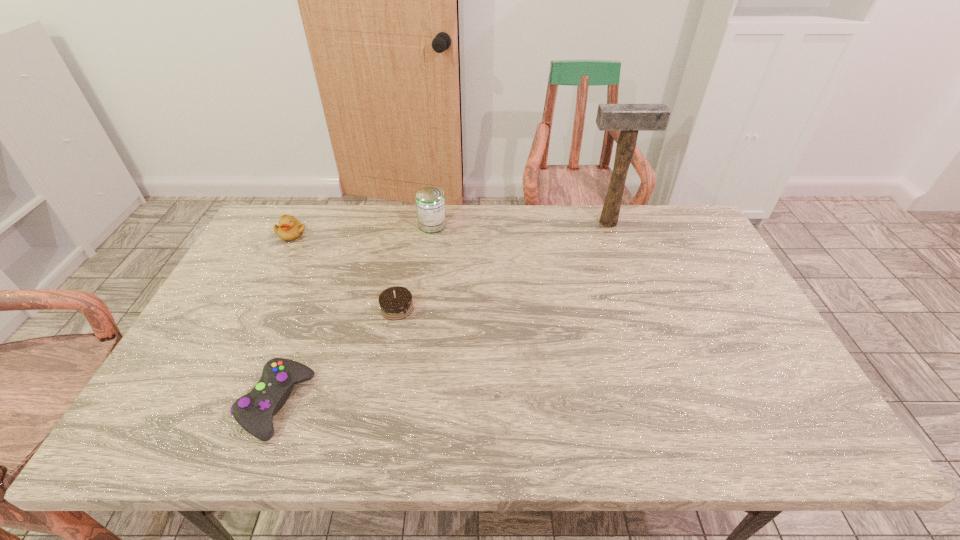
The height and width of the screenshot is (540, 960). What are the coordinates of `the tallest object` in the screenshot? It's located at (628, 118).

You are a GUI agent. You are given a task and a screenshot of the screen. Output one action in this format:
    pyautogui.click(x=<x>, y=<y>)
    Task: Click on the mallet
    
    Given the screenshot: What is the action you would take?
    pyautogui.click(x=628, y=118)

Identify the location of the second tallest object. (430, 202).

You are a GUI agent. You are given a task and a screenshot of the screen. Output one action in this format:
    pyautogui.click(x=<x>, y=<y>)
    Task: Click on the duckling
    This screenshot has width=960, height=540.
    Given the screenshot: What is the action you would take?
    pyautogui.click(x=290, y=228)

The image size is (960, 540). I want to click on the fourth farthest object, so click(x=395, y=302).

This screenshot has height=540, width=960. I want to click on the nearest object, so click(x=254, y=412).

Where is `the second object from left to right`? the second object from left to right is located at coordinates pyautogui.click(x=254, y=412).

Locate an element on the screen. This screenshot has width=960, height=540. vacant area situated on the left of the rightmost object is located at coordinates (519, 222).

Where is `free location located 0.070m on the front of the can`? The image size is (960, 540). free location located 0.070m on the front of the can is located at coordinates (429, 247).

I want to click on vacant space located 0.390m at the beak of the leftmost object, so click(x=241, y=334).